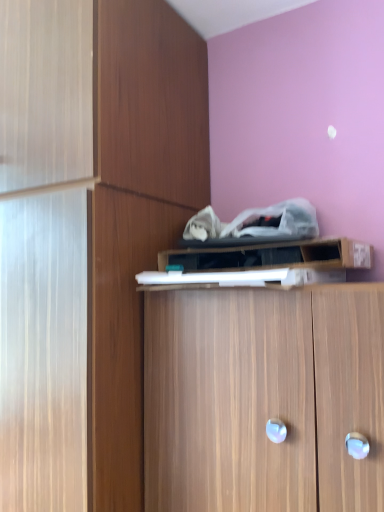
Question: Is wooden cabinet at center, which is counted as the 2th cabinetry, starting from the top, smaller than wooden cabinet at center, the 3th cabinetry in the top-to-bottom sequence?

Choices:
 (A) no
 (B) yes

Answer: (A)

Question: Is wooden cabinet at center, which is counted as the 2th cabinetry, starting from the top, completely or partially outside of wooden cabinet at center, the 1th cabinetry ordered from the bottom?

Choices:
 (A) no
 (B) yes

Answer: (B)

Question: Would you say wooden cabinet at center, the 3th cabinetry in the top-to-bottom sequence, is part of wooden cabinet at center, arranged as the 2th cabinetry when ordered from the bottom,'s contents?

Choices:
 (A) yes
 (B) no

Answer: (B)

Question: From the image's perspective, would you say wooden cabinet at center, arranged as the 2th cabinetry when ordered from the bottom, is positioned over wooden cabinet at center, the 1th cabinetry ordered from the bottom?

Choices:
 (A) no
 (B) yes

Answer: (B)

Question: Is wooden cabinet at center, arranged as the 2th cabinetry when ordered from the bottom, far from wooden cabinet at center, the 3th cabinetry in the top-to-bottom sequence?

Choices:
 (A) no
 (B) yes

Answer: (A)

Question: Would you say wooden cabinet at upper center, placed as the first cabinetry when sorted from top to bottom, is inside or outside wooden cabinet at center, the 3th cabinetry in the top-to-bottom sequence?

Choices:
 (A) inside
 (B) outside

Answer: (B)

Question: In terms of height, does wooden cabinet at upper center, which is the third cabinetry in bottom-to-top order, look taller or shorter compared to wooden cabinet at center, the 3th cabinetry in the top-to-bottom sequence?

Choices:
 (A) tall
 (B) short

Answer: (B)

Question: Looking at their shapes, would you say wooden cabinet at upper center, which is the third cabinetry in bottom-to-top order, is wider or thinner than wooden cabinet at center, the 1th cabinetry ordered from the bottom?

Choices:
 (A) wide
 (B) thin

Answer: (B)

Question: From the image's perspective, is wooden cabinet at upper center, placed as the first cabinetry when sorted from top to bottom, above or below wooden cabinet at center, the 3th cabinetry in the top-to-bottom sequence?

Choices:
 (A) below
 (B) above

Answer: (B)

Question: Is wooden cabinet at center, which is counted as the 2th cabinetry, starting from the top, inside the boundaries of wooden cabinet at upper center, which is the third cabinetry in bottom-to-top order, or outside?

Choices:
 (A) inside
 (B) outside

Answer: (B)

Question: Considering their positions, is wooden cabinet at center, arranged as the 2th cabinetry when ordered from the bottom, located in front of or behind wooden cabinet at upper center, which is the third cabinetry in bottom-to-top order?

Choices:
 (A) behind
 (B) front

Answer: (B)

Question: Considering the positions of wooden cabinet at center, arranged as the 2th cabinetry when ordered from the bottom, and wooden cabinet at upper center, which is the third cabinetry in bottom-to-top order, in the image, is wooden cabinet at center, arranged as the 2th cabinetry when ordered from the bottom, wider or thinner than wooden cabinet at upper center, which is the third cabinetry in bottom-to-top order,?

Choices:
 (A) thin
 (B) wide

Answer: (B)

Question: Considering the positions of point (160, 201) and point (278, 254), is point (160, 201) closer or farther from the camera than point (278, 254)?

Choices:
 (A) farther
 (B) closer

Answer: (A)

Question: Considering the positions of wooden cabinet at center, the 3th cabinetry in the top-to-bottom sequence, and wooden cabinet at upper center, which is the third cabinetry in bottom-to-top order, in the image, is wooden cabinet at center, the 3th cabinetry in the top-to-bottom sequence, bigger or smaller than wooden cabinet at upper center, which is the third cabinetry in bottom-to-top order,?

Choices:
 (A) big
 (B) small

Answer: (A)

Question: Does point (319, 358) appear closer or farther from the camera than point (165, 257)?

Choices:
 (A) farther
 (B) closer

Answer: (B)